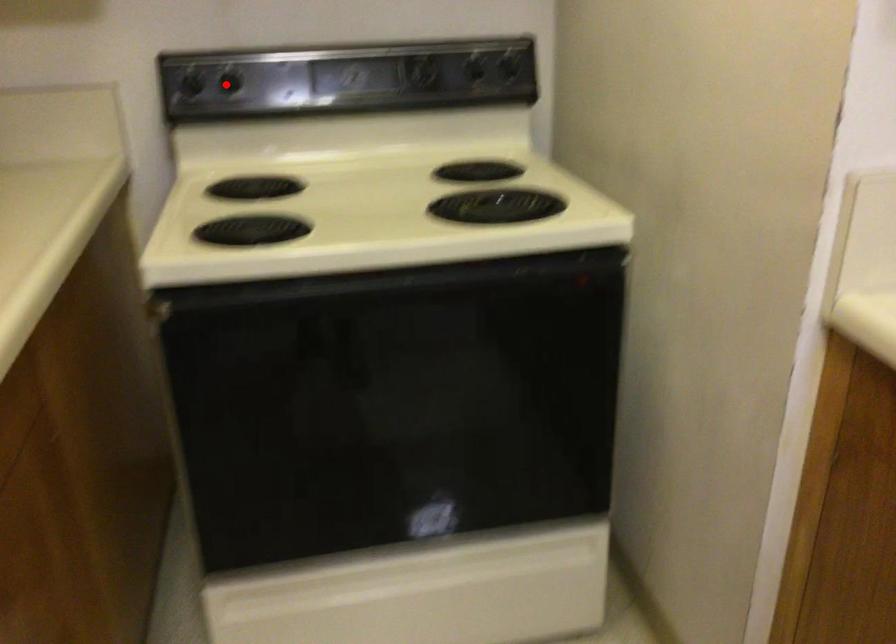
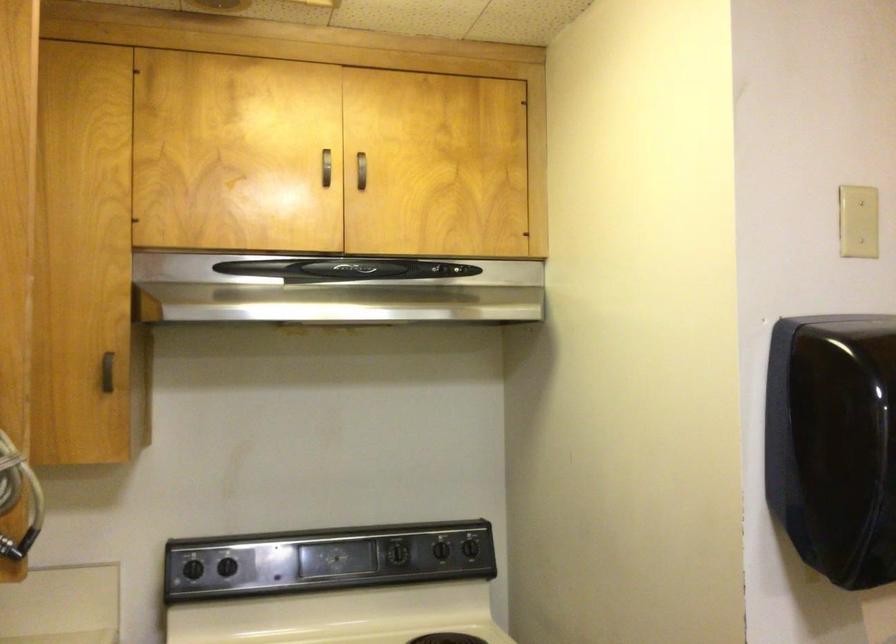
In the second image, find the point that corresponds to the highlighted location in the first image.

(227, 567)